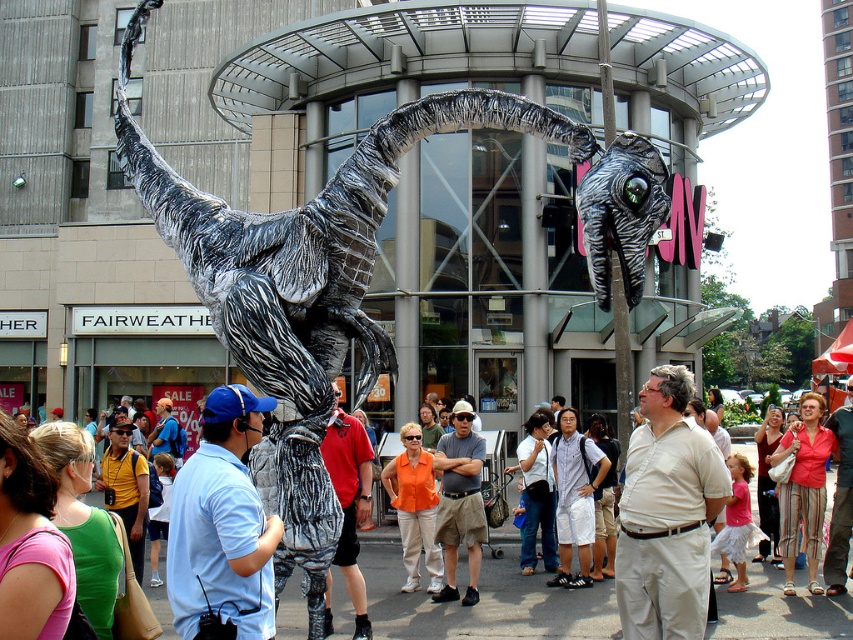
Can you confirm if white cotton shirt at center is positioned below matte red shirt at center?

Indeed, white cotton shirt at center is positioned under matte red shirt at center.

Which is below, white cotton shirt at center or matte red shirt at center?

Positioned lower is white cotton shirt at center.

Identify the location of white cotton shirt at center. (666, 515).

From the picture: Who is more forward, (347, 326) or (602, 280)?

Point (602, 280) is more forward.

Where is `silver metallic dinosaur at center`? Image resolution: width=853 pixels, height=640 pixels. silver metallic dinosaur at center is located at coordinates (306, 284).

Where is `silver metallic dinosaur at center`? silver metallic dinosaur at center is located at coordinates (306, 284).

Can you confirm if silver metallic dinosaur at center is positioned above khaki shorts at center?

Correct, silver metallic dinosaur at center is located above khaki shorts at center.

Which is in front, point (592, 243) or point (450, 566)?

Point (592, 243) is in front.

This screenshot has width=853, height=640. In order to click on silver metallic dinosaur at center in this screenshot , I will do `click(306, 284)`.